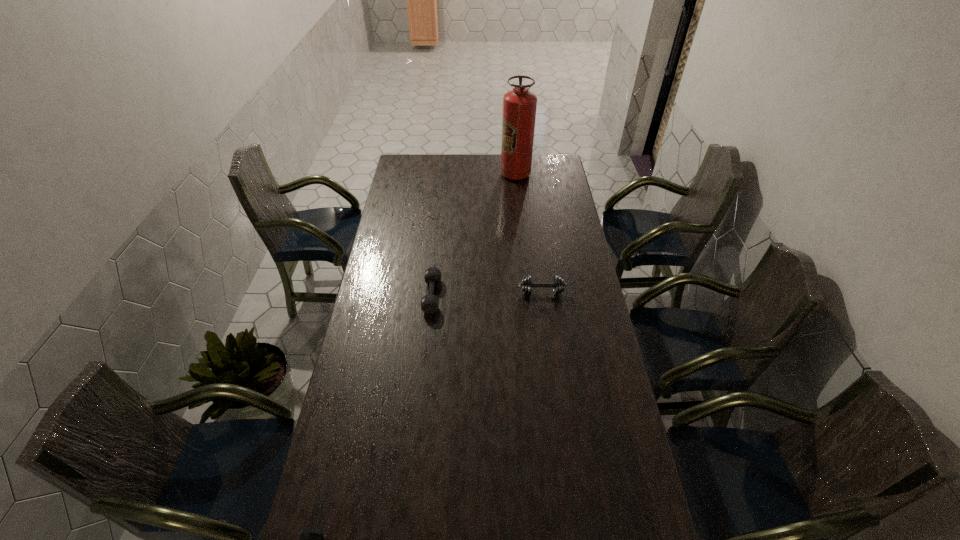
This screenshot has height=540, width=960. Identify the location of object situated at the far edge. (519, 105).

Where is `object located in the right edge section of the desktop`? object located in the right edge section of the desktop is located at coordinates (558, 284).

You are a GUI agent. You are given a task and a screenshot of the screen. Output one action in this format:
    pyautogui.click(x=<x>, y=<y>)
    Task: Click on the free region at the left edge of the desktop
    The height and width of the screenshot is (540, 960).
    Given the screenshot: What is the action you would take?
    pyautogui.click(x=409, y=188)

In the image, there is a desktop. Where is `vacant space at the right edge`? The image size is (960, 540). vacant space at the right edge is located at coordinates (636, 465).

Locate an element on the screen. Image resolution: width=960 pixels, height=540 pixels. vacant space at the far right corner of the desktop is located at coordinates (551, 166).

This screenshot has width=960, height=540. Identify the location of free spot between the farthest object and the second dumbbell from left to right. (473, 235).

Identify which object is the second nearest to the second dumbbell from right to left. Please provide its 2D coordinates. Your answer should be formatted as a tuple, i.e. [(x, y)], where the tuple contains the x and y coordinates of a point satisfying the conditions above.

[(519, 105)]

Locate an element on the screen. The height and width of the screenshot is (540, 960). object that can be found as the closest to the tallest object is located at coordinates (558, 284).

Where is `dumbbell that is the closest to the tallest object`? This screenshot has width=960, height=540. dumbbell that is the closest to the tallest object is located at coordinates (558, 284).

Locate an element on the screen. This screenshot has height=540, width=960. dumbbell that stands as the closest to the leftmost object is located at coordinates (429, 303).